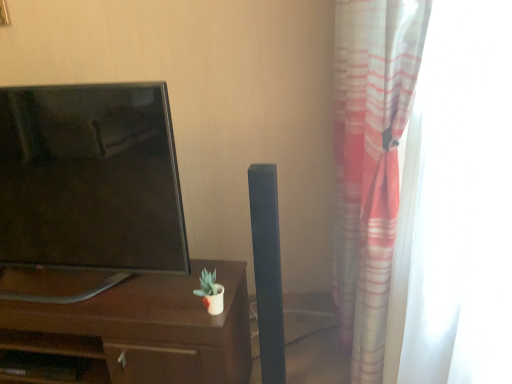
Where is `brown wood desk at center`? Image resolution: width=512 pixels, height=384 pixels. brown wood desk at center is located at coordinates (144, 330).

The image size is (512, 384). Describe the element at coordinates (144, 330) in the screenshot. I see `brown wood desk at center` at that location.

Locate an element on the screen. The width and height of the screenshot is (512, 384). matte black tv at left is located at coordinates (90, 178).

Image resolution: width=512 pixels, height=384 pixels. What are the coordinates of `brown wood desk at center` in the screenshot? It's located at (144, 330).

Is brown wood desk at center turned away from matte black tv at left?

No.

Is brown wood desk at center in contact with matte black tv at left?

There is a gap between brown wood desk at center and matte black tv at left.

You are a GUI agent. You are given a task and a screenshot of the screen. Output one action in this format:
    pyautogui.click(x=<x>, y=<y>)
    Task: Click on the desk that is below the matte black tv at left (from the image's perspective)
    The width and height of the screenshot is (512, 384).
    Given the screenshot: What is the action you would take?
    pyautogui.click(x=144, y=330)

Is brown wood desk at center bigger or smaller than matte black tv at left?

brown wood desk at center is bigger than matte black tv at left.

From a real-world perspective, is translucent fabric curtain at right on top of matte black tv at left?

No, from a real-world perspective, translucent fabric curtain at right is not over matte black tv at left

Is translucent fabric curtain at right facing away from matte black tv at left?

Yes, translucent fabric curtain at right is positioned with its back facing matte black tv at left.

Is translucent fabric curtain at right positioned far away from matte black tv at left?

That's right, there is a large distance between translucent fabric curtain at right and matte black tv at left.

Considering the positions of objects translucent fabric curtain at right and matte black tv at left in the image provided, who is more to the left, translucent fabric curtain at right or matte black tv at left?

Positioned to the left is matte black tv at left.

From a real-world perspective, which object stands above the other?

translucent fabric curtain at right is physically above.

From the image's perspective, is brown wood desk at center on top of translucent fabric curtain at right?

No, from the image's perspective, brown wood desk at center is not on top of translucent fabric curtain at right.

Is brown wood desk at center aimed at translucent fabric curtain at right?

No, brown wood desk at center is not turned towards translucent fabric curtain at right.

Can you confirm if brown wood desk at center is wider than translucent fabric curtain at right?

Correct, the width of brown wood desk at center exceeds that of translucent fabric curtain at right.

Is matte black tv at left shorter than brown wood desk at center?

In fact, matte black tv at left may be taller than brown wood desk at center.

Does matte black tv at left appear on the left side of brown wood desk at center?

No.

Measure the distance from matte black tv at left to brown wood desk at center.

They are 12.16 inches apart.

Who is more distant, matte black tv at left or brown wood desk at center?

brown wood desk at center.

Is translucent fabric curtain at right far away from brown wood desk at center?

translucent fabric curtain at right is near brown wood desk at center, not far away.

Considering their positions, is translucent fabric curtain at right located in front of or behind brown wood desk at center?

translucent fabric curtain at right is positioned closer to the viewer than brown wood desk at center.

From the picture: Considering the relative sizes of translucent fabric curtain at right and brown wood desk at center in the image provided, is translucent fabric curtain at right smaller than brown wood desk at center?

No, translucent fabric curtain at right is not smaller than brown wood desk at center.

Is translucent fabric curtain at right turned away from brown wood desk at center?

No, translucent fabric curtain at right is not facing the opposite direction of brown wood desk at center.

How distant is matte black tv at left from translucent fabric curtain at right?

A distance of 3.35 feet exists between matte black tv at left and translucent fabric curtain at right.

How different are the orientations of matte black tv at left and translucent fabric curtain at right in degrees?

The angular difference between matte black tv at left and translucent fabric curtain at right is 80.6 degrees.

Could you tell me if matte black tv at left is facing translucent fabric curtain at right?

No, matte black tv at left is not turned towards translucent fabric curtain at right.

Is matte black tv at left placed right next to translucent fabric curtain at right?

matte black tv at left is not next to translucent fabric curtain at right, and they're not touching.

Find the location of a particular element. television that appears on the right of brown wood desk at center is located at coordinates (90, 178).

At what (x,y) coordinates should I click in order to perform the action: click on glass door in front of the matte black tv at left. Please return your answer as a coordinate pair (x, y). The image size is (512, 384). Looking at the image, I should click on (459, 201).

Looking at the image, which one is located closer to translucent fabric curtain at right, brown wood desk at center or matte black tv at left?

brown wood desk at center is closer to translucent fabric curtain at right.

Which object lies further to the anchor point translucent fabric curtain at right, matte black tv at left or brown wood desk at center?

matte black tv at left is positioned further to the anchor translucent fabric curtain at right.

When comparing their distances from brown wood desk at center, does matte black tv at left or translucent fabric curtain at right seem closer?

Among the two, matte black tv at left is located nearer to brown wood desk at center.

Estimate the real-world distances between objects in this image. Which object is further from brown wood desk at center, translucent fabric curtain at right or matte black tv at left?

Among the two, translucent fabric curtain at right is located further to brown wood desk at center.

Based on their spatial positions, is translucent fabric curtain at right or brown wood desk at center closer to matte black tv at left?

Based on the image, brown wood desk at center appears to be nearer to matte black tv at left.

Based on the photo, looking at the image, which one is located further to matte black tv at left, brown wood desk at center or translucent fabric curtain at right?

Among the two, translucent fabric curtain at right is located further to matte black tv at left.

This screenshot has width=512, height=384. I want to click on television between brown wood desk at center and translucent fabric curtain at right from left to right, so click(x=90, y=178).